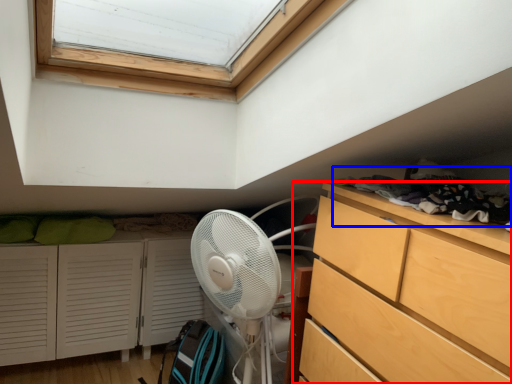
Question: Which point is further to the camera, chest of drawers (highlighted by a red box) or laundry (highlighted by a blue box)?

Choices:
 (A) chest of drawers
 (B) laundry

Answer: (B)